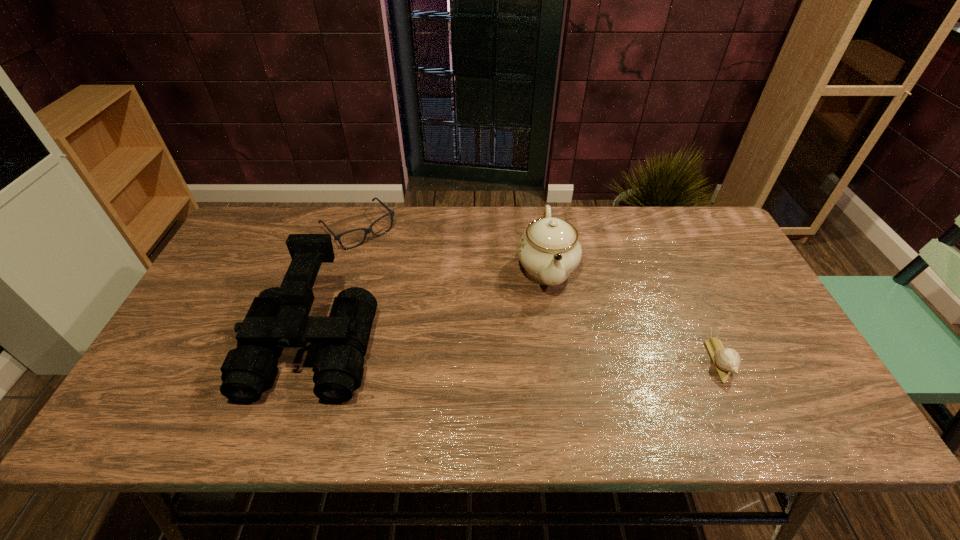
In the image, there is a desktop. Where is `free region at the far right corner`? free region at the far right corner is located at coordinates (672, 208).

At what (x,y) coordinates should I click in order to perform the action: click on free spot between the third object from left to right and the rightmost object. Please return your answer as a coordinate pair (x, y). The width and height of the screenshot is (960, 540). Looking at the image, I should click on coord(633,314).

The height and width of the screenshot is (540, 960). I want to click on blank region between the spectacles and the second tallest object, so click(452, 248).

The image size is (960, 540). Identify the location of vacant point located between the rightmost object and the second object from right to left. (633, 314).

Where is `unoccupied area between the spectacles and the tallest object`? unoccupied area between the spectacles and the tallest object is located at coordinates (336, 286).

Find the location of a particular element. Image resolution: width=960 pixels, height=540 pixels. free space between the binoculars and the third shortest object is located at coordinates (430, 306).

In order to click on empty space that is in between the chinaware and the spectacles in this screenshot , I will do `click(452, 248)`.

Locate an element on the screen. vacant area between the tallest object and the spectacles is located at coordinates (336, 286).

This screenshot has height=540, width=960. I want to click on vacant area that lies between the chinaware and the escargot, so click(x=633, y=314).

Locate an element on the screen. The width and height of the screenshot is (960, 540). empty space between the spectacles and the third shortest object is located at coordinates (452, 248).